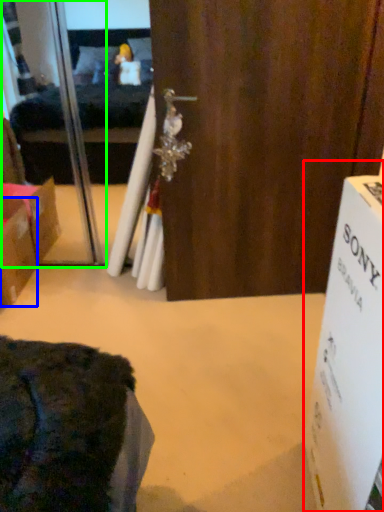
Question: Estimate the real-world distances between objects in this image. Which object is closer to cardboard box (highlighted by a red box), box (highlighted by a blue box) or screen door (highlighted by a green box)?

Choices:
 (A) box
 (B) screen door

Answer: (A)